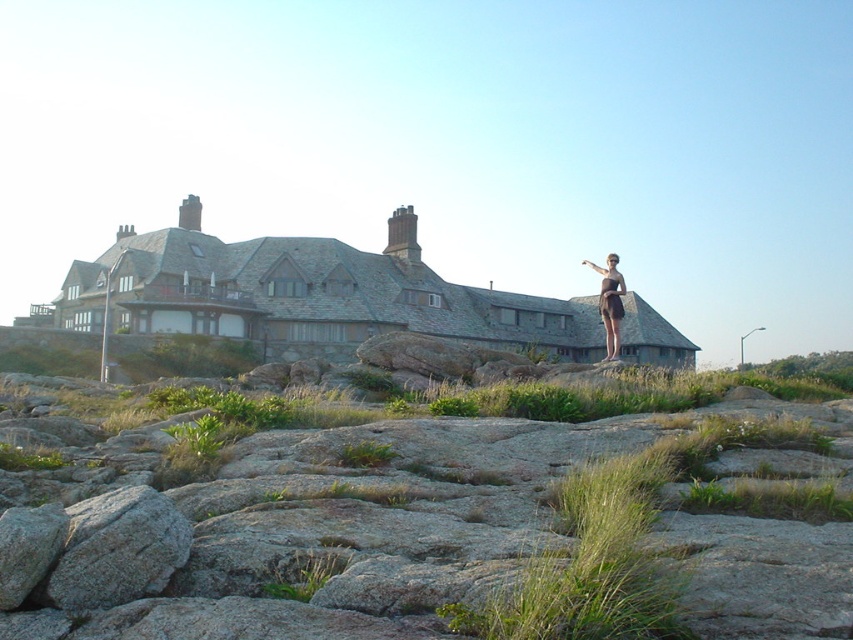
Does gray rock at upper center have a greater height compared to brown matte dress at upper right?

Incorrect, gray rock at upper center's height is not larger of brown matte dress at upper right's.

Identify the location of gray rock at upper center. (427, 509).